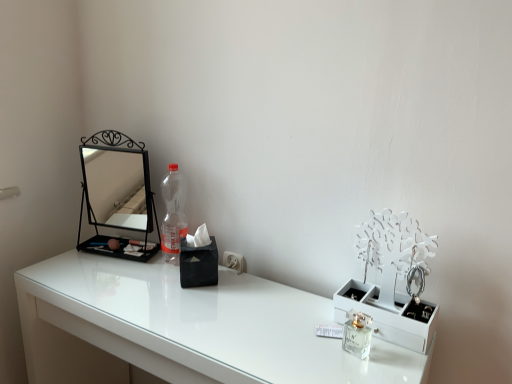
Question: Choose the correct answer: Is clear glass perfume at center inside white glossy table at center or outside it?

Choices:
 (A) outside
 (B) inside

Answer: (A)

Question: Is point (365, 342) closer or farther from the camera than point (326, 317)?

Choices:
 (A) farther
 (B) closer

Answer: (B)

Question: Considering the real-world distances, which object is closest to the black metal mirror at left?

Choices:
 (A) clear glass perfume at center
 (B) white glossy table at center

Answer: (B)

Question: Which is nearer to the white glossy table at center?

Choices:
 (A) black metal mirror at left
 (B) clear glass perfume at center

Answer: (A)